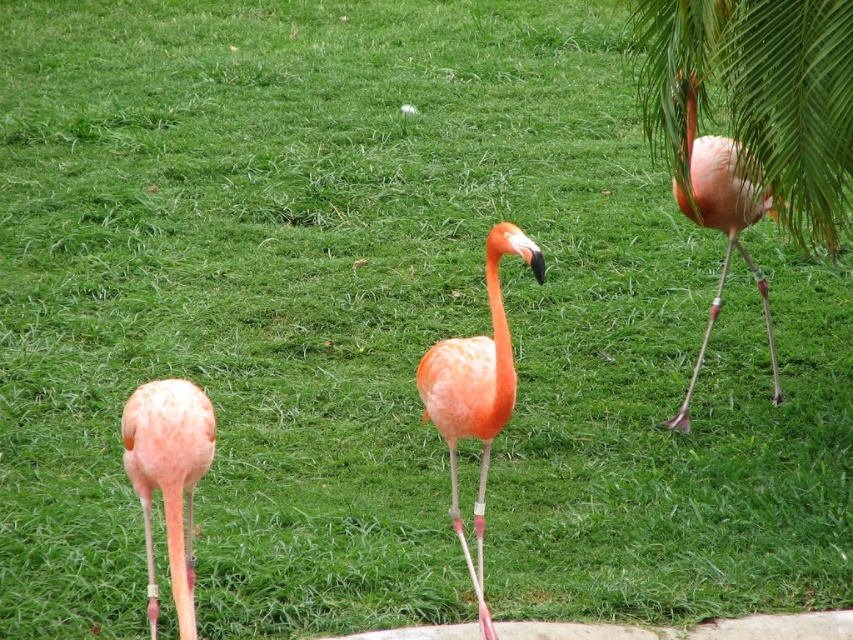
Does pink matte flamingo at lower left have a smaller size compared to pink matte flamingo at upper right?

Yes.

This screenshot has width=853, height=640. In order to click on pink matte flamingo at lower left in this screenshot , I will do `click(167, 477)`.

Does orange matte flamingo at center appear under pink matte flamingo at upper right?

Indeed, orange matte flamingo at center is positioned under pink matte flamingo at upper right.

Is point (450, 440) farther from camera compared to point (764, 288)?

That is False.

Is point (469, 372) less distant than point (693, 166)?

Yes, it is in front of point (693, 166).

At what (x,y) coordinates should I click in order to perform the action: click on orange matte flamingo at center. Please return your answer as a coordinate pair (x, y). The image size is (853, 640). Looking at the image, I should click on (476, 390).

Which is below, orange matte flamingo at center or pink matte flamingo at lower left?

Positioned lower is pink matte flamingo at lower left.

Does orange matte flamingo at center appear on the right side of pink matte flamingo at lower left?

Correct, you'll find orange matte flamingo at center to the right of pink matte flamingo at lower left.

Where is `orange matte flamingo at center`? The height and width of the screenshot is (640, 853). orange matte flamingo at center is located at coordinates (476, 390).